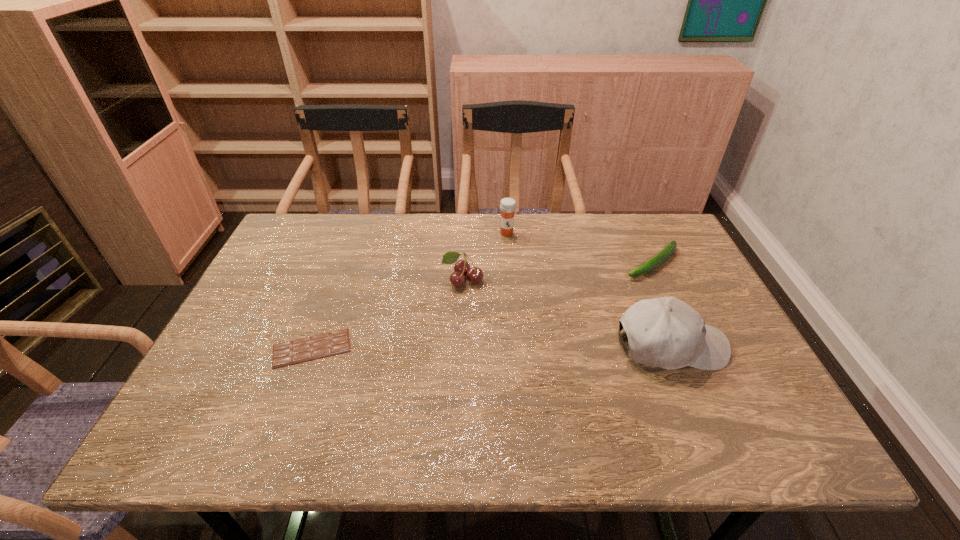
Find the location of a particular element. vacant point located 0.400m on the label side of the third object from right to left is located at coordinates point(510,333).

This screenshot has height=540, width=960. Identify the location of vacant space located 0.140m on the label side of the third object from right to left. (508, 266).

In order to click on blank space located 0.160m on the leaves of the second object from left to right in this screenshot , I will do `click(447, 335)`.

This screenshot has width=960, height=540. I want to click on free space located 0.110m on the leaves of the second object from left to right, so click(451, 320).

Find the location of a particular element. Image resolution: width=960 pixels, height=540 pixels. free space located on the leaves of the second object from left to right is located at coordinates (450, 323).

Identify the location of vacant area located 0.110m on the front-facing side of the fourth tallest object. The width and height of the screenshot is (960, 540). (609, 291).

At what (x,y) coordinates should I click in order to perform the action: click on vacant space located on the front-facing side of the fourth tallest object. Please return your answer as a coordinate pair (x, y). The height and width of the screenshot is (540, 960). Looking at the image, I should click on (586, 308).

Identify the location of vacant space located on the front-facing side of the fourth tallest object. The height and width of the screenshot is (540, 960). (620, 283).

Where is `medicine located in the far edge section of the desktop`? Image resolution: width=960 pixels, height=540 pixels. medicine located in the far edge section of the desktop is located at coordinates (508, 205).

Identify the location of zucchini at the far edge. (667, 251).